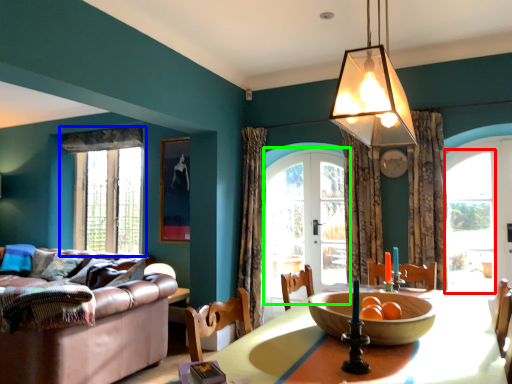
Question: Which object is the farthest from window (highlighted by a red box)? Choose among these: window (highlighted by a blue box) or screen door (highlighted by a green box).

Choices:
 (A) window
 (B) screen door

Answer: (A)